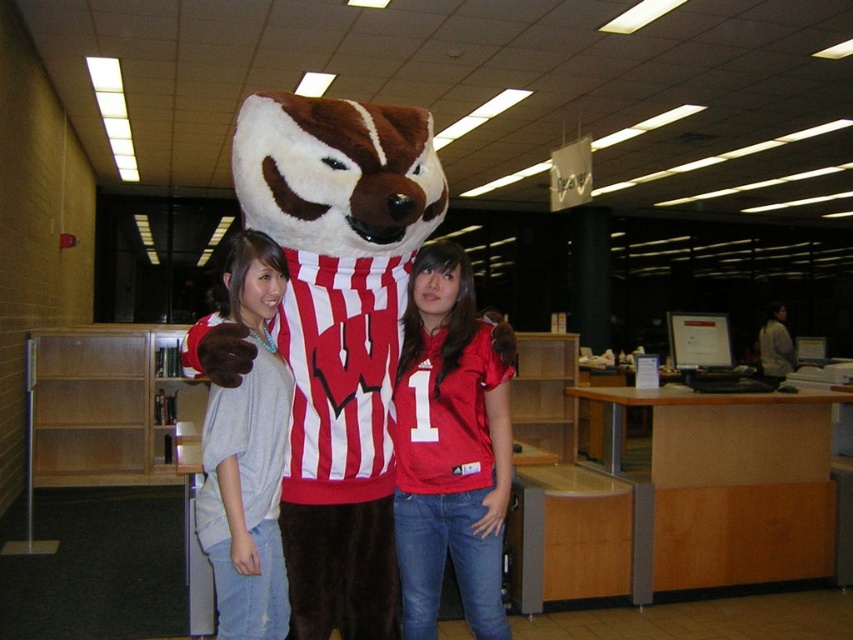
Is brown plush mascot at center to the right of light gray cotton shirt at center from the viewer's perspective?

Indeed, brown plush mascot at center is positioned on the right side of light gray cotton shirt at center.

Which of these two, brown plush mascot at center or light gray cotton shirt at center, stands taller?

brown plush mascot at center is taller.

Is point (287, 141) positioned in front of point (213, 337)?

No, (287, 141) is further to viewer.

What are the coordinates of `brown plush mascot at center` in the screenshot? It's located at (339, 332).

Does matte red jersey at center have a greater height compared to light gray cotton shirt at center?

Indeed, matte red jersey at center has a greater height compared to light gray cotton shirt at center.

Is matte red jersey at center bigger than light gray cotton shirt at center?

No.

The height and width of the screenshot is (640, 853). In order to click on matte red jersey at center in this screenshot , I will do `click(450, 445)`.

Where is `matte red jersey at center`? matte red jersey at center is located at coordinates (450, 445).

Is point (360, 228) positioned behind point (468, 492)?

No.

Is brown plush mascot at center closer to camera compared to matte red jersey at center?

Yes, it is in front of matte red jersey at center.

Is point (311, 572) in front of point (408, 385)?

Yes, point (311, 572) is in front of point (408, 385).

This screenshot has width=853, height=640. Find the location of `brown plush mascot at center`. brown plush mascot at center is located at coordinates (339, 332).